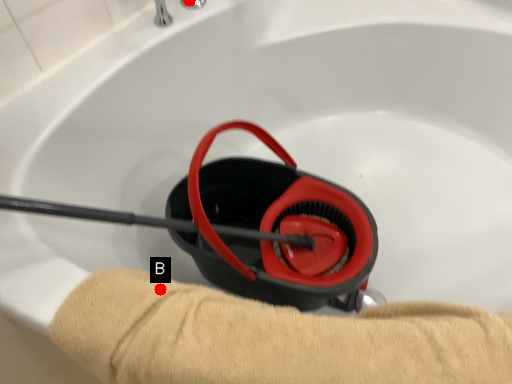
Question: Two points are circled on the image, labeled by A and B beside each circle. Which point appears closest to the camera in this image?

Choices:
 (A) A is closer
 (B) B is closer

Answer: (B)